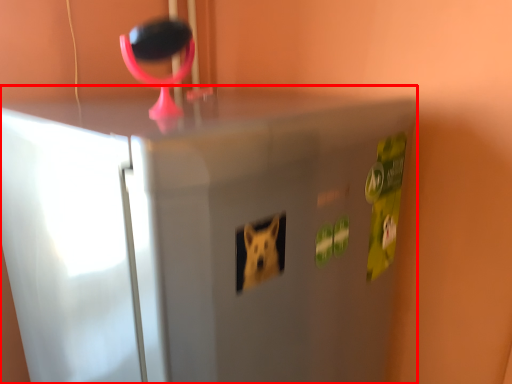
Question: Considering the relative positions of refrigerator (annotated by the red box) and magnifying glass in the image provided, where is refrigerator (annotated by the red box) located with respect to the staircase?

Choices:
 (A) left
 (B) right

Answer: (B)